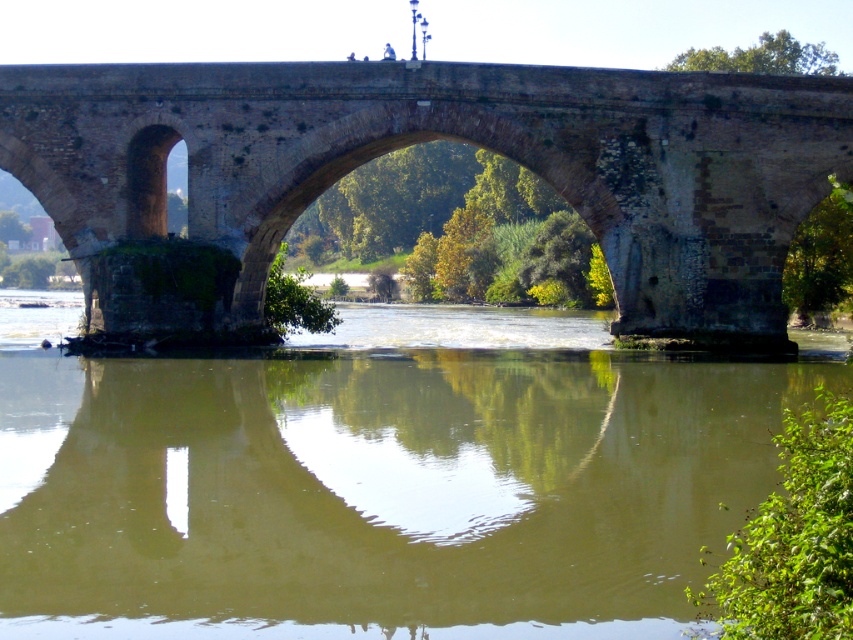
Image resolution: width=853 pixels, height=640 pixels. Describe the element at coordinates (378, 477) in the screenshot. I see `greenish-brown water at center` at that location.

Does greenish-brown water at center have a lesser height compared to brown stone bridge at center?

Yes, greenish-brown water at center is shorter than brown stone bridge at center.

Locate an element on the screen. greenish-brown water at center is located at coordinates (378, 477).